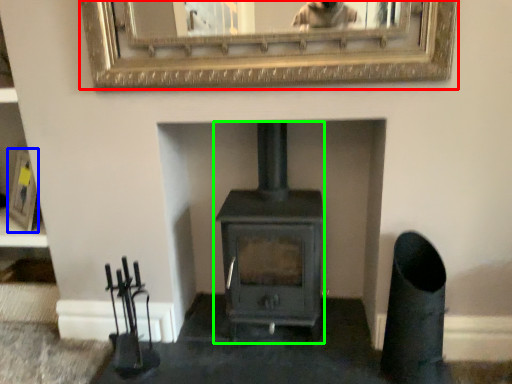
Question: Which object is positioned closest to picture frame (highlighted by a red box)? Select from picture frame (highlighted by a blue box) and wood burning stove (highlighted by a green box).

Choices:
 (A) picture frame
 (B) wood burning stove

Answer: (B)